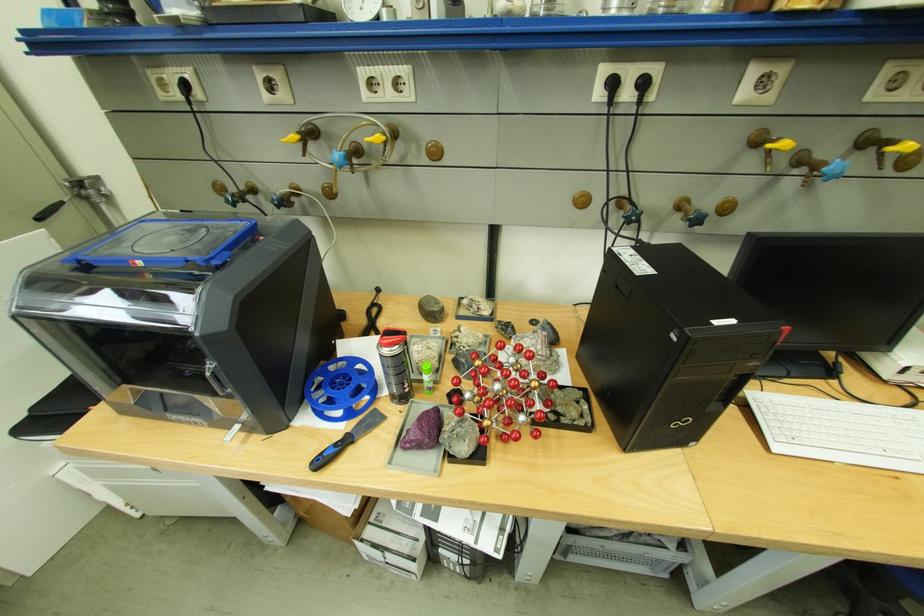
I want to click on blue filament spool, so click(x=341, y=389).